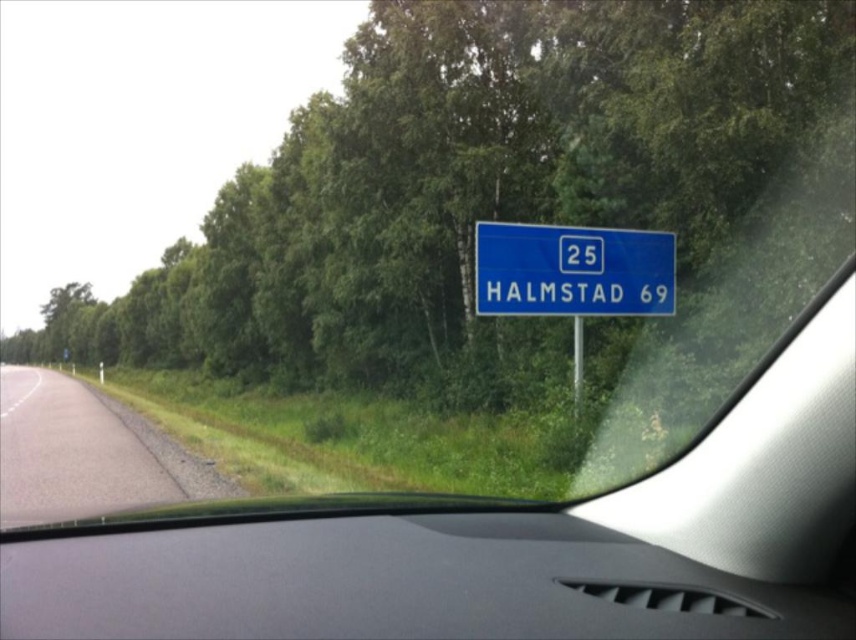
Is black matte dashboard at center thinner than blue plastic sign at center?

Incorrect, black matte dashboard at center's width is not less than blue plastic sign at center's.

Between point (217, 624) and point (562, 269), which one is positioned in front?

Point (217, 624) is in front.

Measure the distance between black matte dashboard at center and camera.

black matte dashboard at center is 133.49 meters from camera.

Find the location of `black matte dashboard at center`. black matte dashboard at center is located at coordinates (391, 582).

Is gray asphalt road at lower left to the right of blue plastic sign at center from the viewer's perspective?

In fact, gray asphalt road at lower left is to the left of blue plastic sign at center.

This screenshot has height=640, width=856. Identify the location of gray asphalt road at lower left. (68, 452).

Which of these two, black matte dashboard at center or gray asphalt road at lower left, stands shorter?

With less height is gray asphalt road at lower left.

Where is `black matte dashboard at center`? This screenshot has width=856, height=640. black matte dashboard at center is located at coordinates (391, 582).

Identify the location of black matte dashboard at center. This screenshot has width=856, height=640. (391, 582).